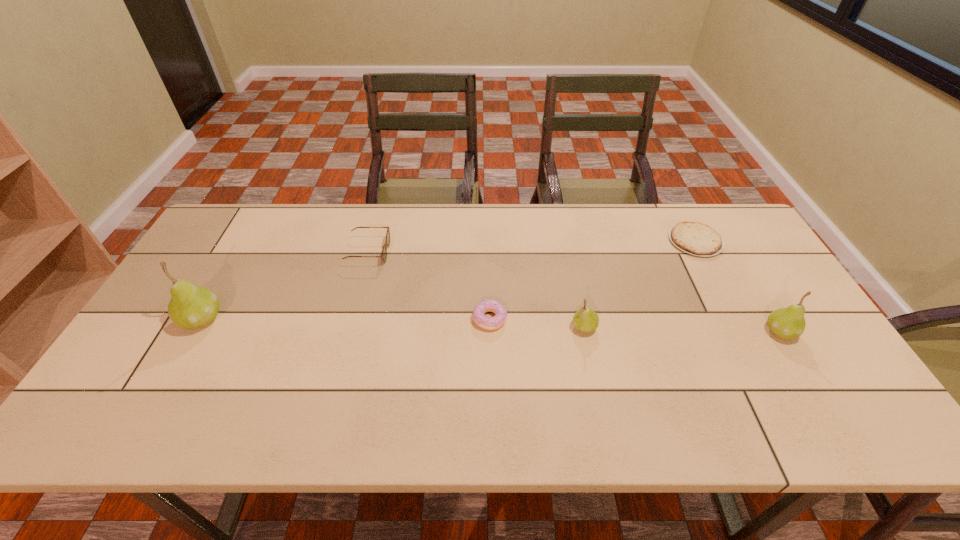
Identify the location of the tallest object. The image size is (960, 540). (191, 306).

Where is `the leftmost pear`? The height and width of the screenshot is (540, 960). the leftmost pear is located at coordinates (191, 306).

The height and width of the screenshot is (540, 960). What are the coordinates of `the third object from right to left` in the screenshot? It's located at (585, 320).

Identify the location of the shortest pear. (585, 320).

Where is `the second shortest pear`? the second shortest pear is located at coordinates (787, 323).

Locate an element on the screen. Image resolution: width=960 pixels, height=540 pixels. the second tallest object is located at coordinates (787, 323).

Locate an element on the screen. The height and width of the screenshot is (540, 960). the fourth tallest object is located at coordinates (384, 251).

The height and width of the screenshot is (540, 960). I want to click on the fifth object from right to left, so click(x=384, y=251).

Identify the location of the shortest object. (695, 238).

At what (x,y) coordinates should I click in order to perform the action: click on doughnut. Please return your answer as a coordinate pair (x, y). Looking at the image, I should click on (489, 323).